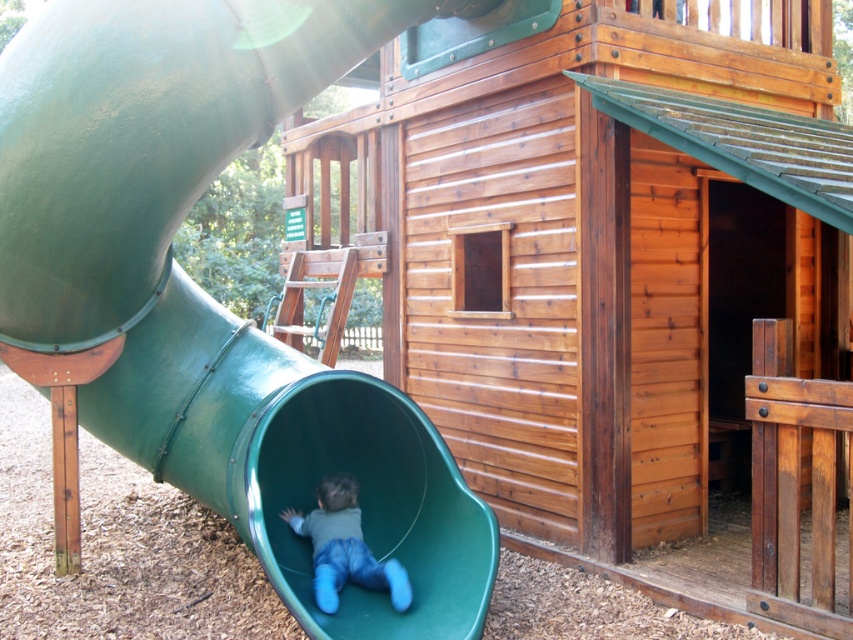
You are standing at the center of the playground and want to go to the green rubber slide at left. Which direction should you move in to reach it?

The green rubber slide at left is located at point 0.461 on the x and 0.244 on the y, so you should move towards the left and slightly forward to reach it.

You are a parent trying to locate your child who is hiding behind an object in the playground. You can see the wooden cabin at center and the matte green slide at lower left. Which object should you check behind to find your child?

The matte green slide at lower left is behind the wooden cabin at center, so you should check behind the wooden cabin at center to find your child.

You are a photographer standing at the center of the playground. You want to take a photo that includes both the point at coordinates point (398, 113) and point (381, 570). Which point is closer to the camera so that you can focus on it first?

Point (398, 113) is closer to the camera than point (381, 570), so you should focus on point (398, 113) first.